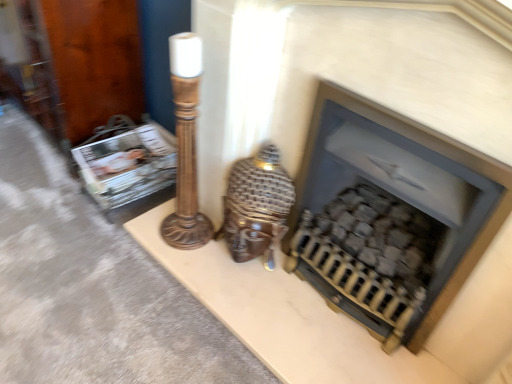
Question: From a real-world perspective, is brown wooden table lamp at center on matte black fireplace at center?

Choices:
 (A) yes
 (B) no

Answer: (B)

Question: Is brown wooden table lamp at center further to camera compared to matte black fireplace at center?

Choices:
 (A) yes
 (B) no

Answer: (A)

Question: From the image's perspective, does brown wooden table lamp at center appear higher than matte black fireplace at center?

Choices:
 (A) no
 (B) yes

Answer: (B)

Question: Could you tell me if brown wooden table lamp at center is turned towards matte black fireplace at center?

Choices:
 (A) yes
 (B) no

Answer: (B)

Question: Does brown wooden table lamp at center appear on the left side of matte black fireplace at center?

Choices:
 (A) yes
 (B) no

Answer: (A)

Question: From the image's perspective, does brown wooden table lamp at center appear lower than matte black fireplace at center?

Choices:
 (A) no
 (B) yes

Answer: (A)

Question: Is brown wooden table lamp at center at the left side of matte plastic magazine at left?

Choices:
 (A) yes
 (B) no

Answer: (B)

Question: Can we say brown wooden table lamp at center lies outside matte plastic magazine at left?

Choices:
 (A) yes
 (B) no

Answer: (A)

Question: Is brown wooden table lamp at center at the right side of matte plastic magazine at left?

Choices:
 (A) no
 (B) yes

Answer: (B)

Question: From the image's perspective, is brown wooden table lamp at center above matte plastic magazine at left?

Choices:
 (A) no
 (B) yes

Answer: (A)

Question: Can you confirm if brown wooden table lamp at center is shorter than matte plastic magazine at left?

Choices:
 (A) no
 (B) yes

Answer: (A)

Question: Would you say matte plastic magazine at left is part of brown wooden table lamp at center's contents?

Choices:
 (A) no
 (B) yes

Answer: (A)

Question: From the image's perspective, does matte plastic magazine at left appear lower than brown wooden table lamp at center?

Choices:
 (A) no
 (B) yes

Answer: (A)